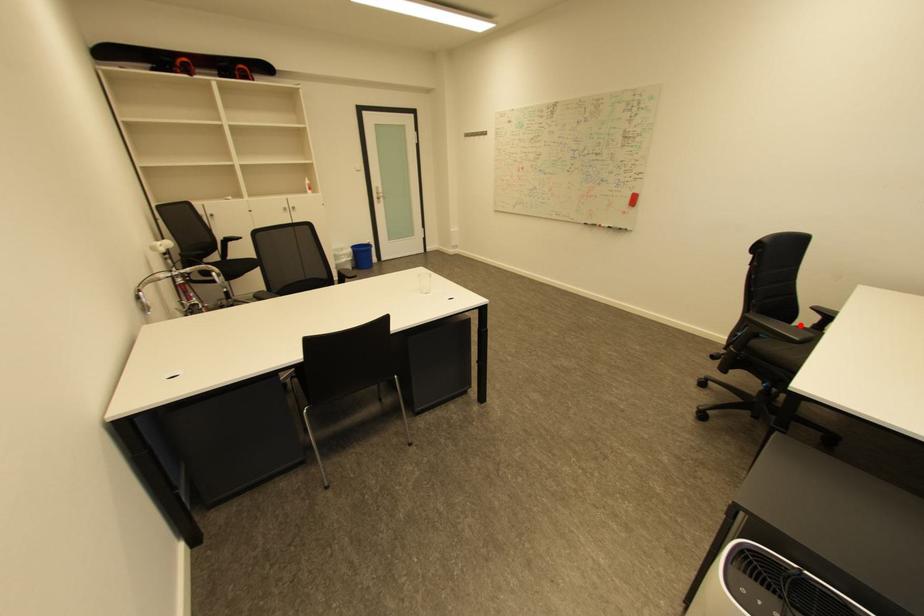
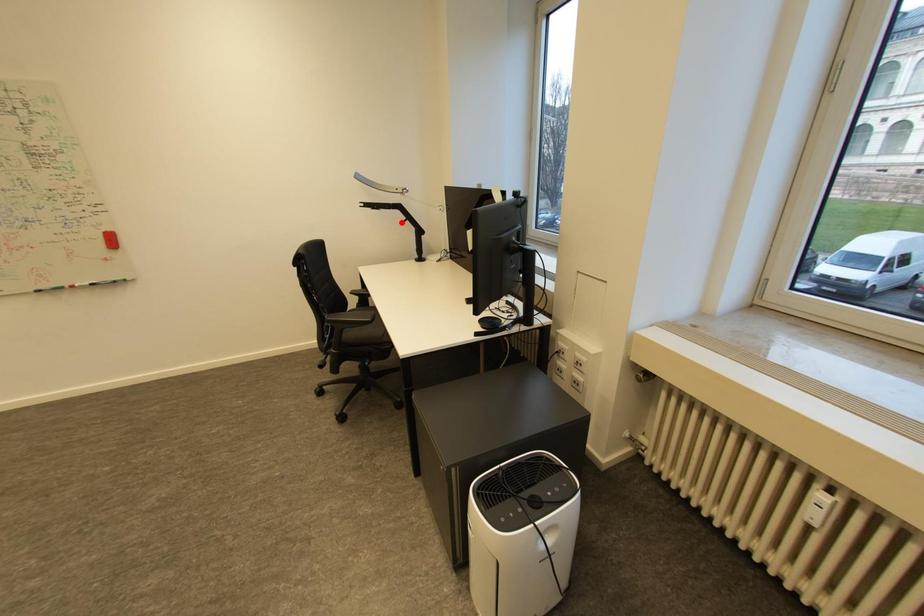
I am providing you with two images of the same scene from different viewpoints. A red point is marked on the first image and another point is marked on the second image. Does the point marked in image1 correspond to the same location as the one in image2?

No